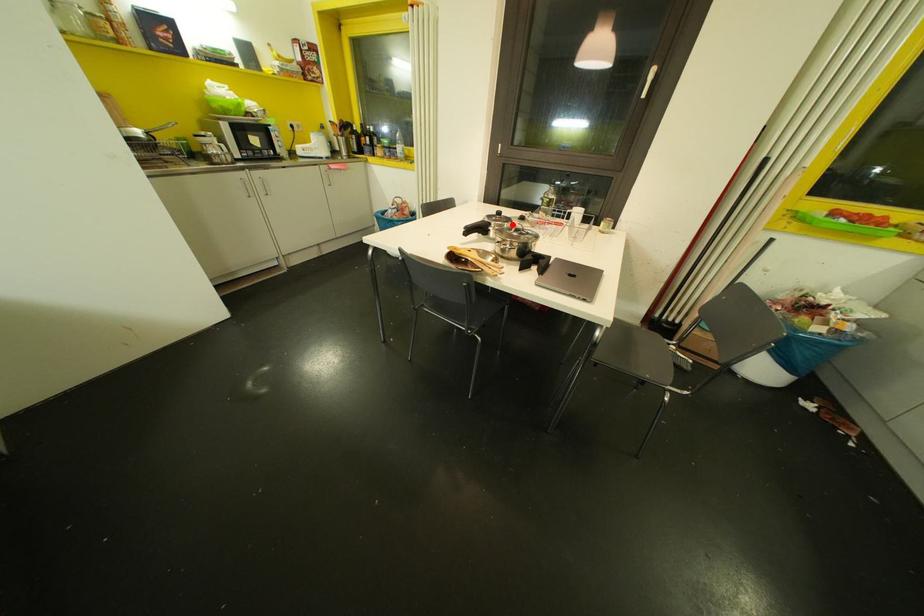
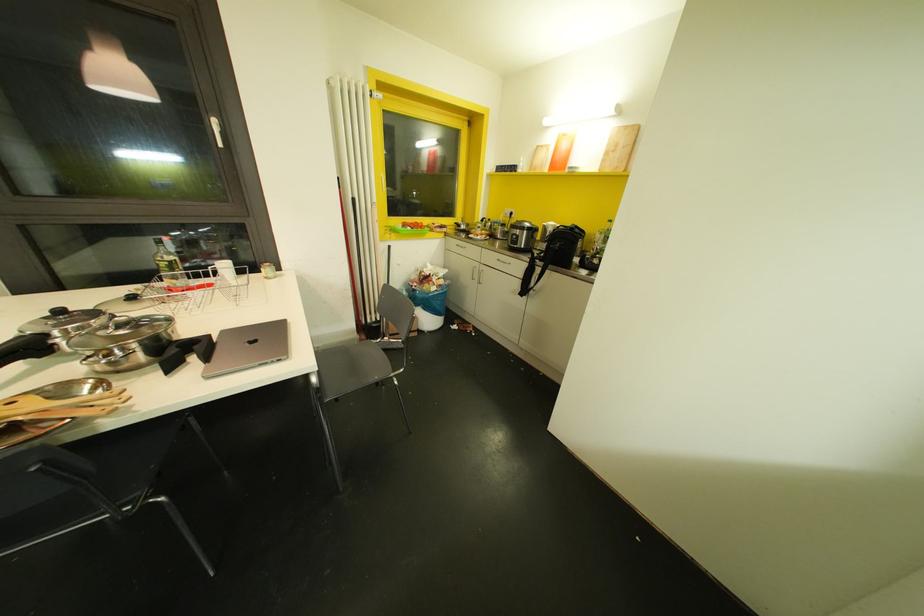
In the second image, find the point that corresponds to the highlighted location in the first image.

(113, 317)